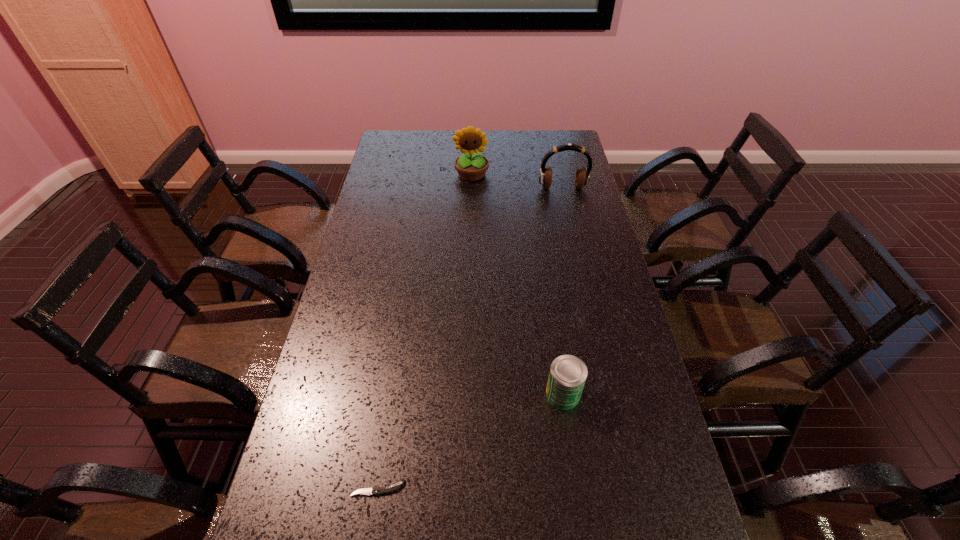
This screenshot has width=960, height=540. What are the coordinates of `free space that satisfies the following two spatial constraints: 1. on the face of the sunflower; 2. on the left side of the second nearest object` in the screenshot? It's located at (467, 394).